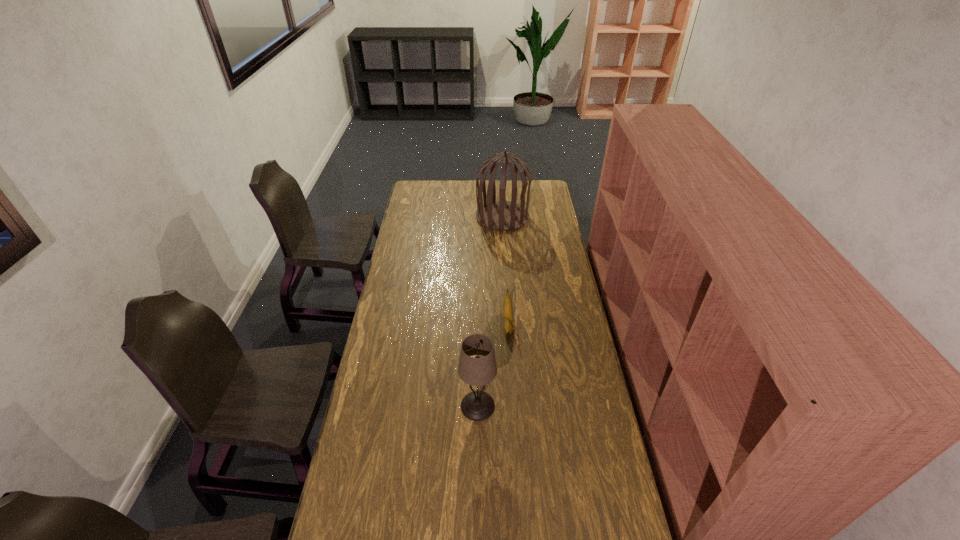
The width and height of the screenshot is (960, 540). Identify the location of vacant space that is in between the tallest object and the banana. (505, 272).

Find the location of `object that is the closest one to the birdcage`. object that is the closest one to the birdcage is located at coordinates (507, 304).

Locate which object is the second closest to the farthest object. Please provide its 2D coordinates. Your answer should be formatted as a tuple, i.e. [(x, y)], where the tuple contains the x and y coordinates of a point satisfying the conditions above.

[(477, 405)]

Find the location of `vacant space that satisfies the following two spatial constraints: 1. at the start of the peel on the second nearest object; 2. on the front-facing side of the second shortest object`. vacant space that satisfies the following two spatial constraints: 1. at the start of the peel on the second nearest object; 2. on the front-facing side of the second shortest object is located at coordinates (514, 406).

This screenshot has height=540, width=960. In order to click on free space that satisfies the following two spatial constraints: 1. at the start of the peel on the shortest object; 2. on the front-facing side of the nearest object in this screenshot , I will do `click(514, 406)`.